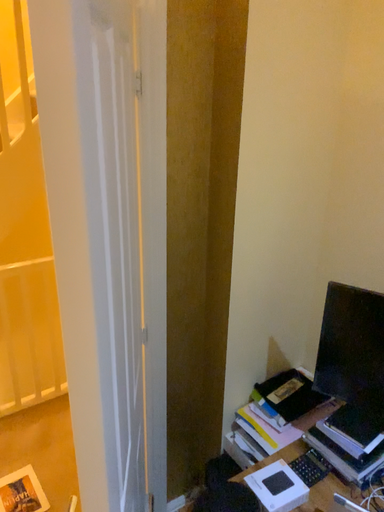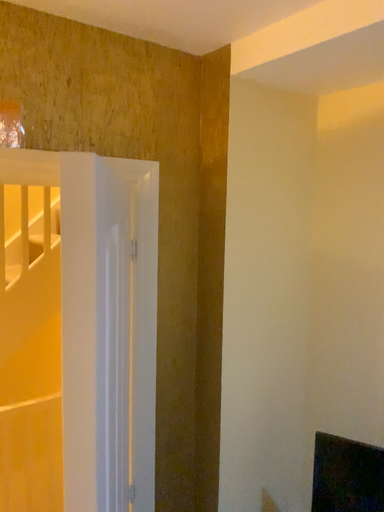
Question: How did the camera likely rotate when shooting the video?

Choices:
 (A) rotated downward
 (B) rotated upward

Answer: (B)